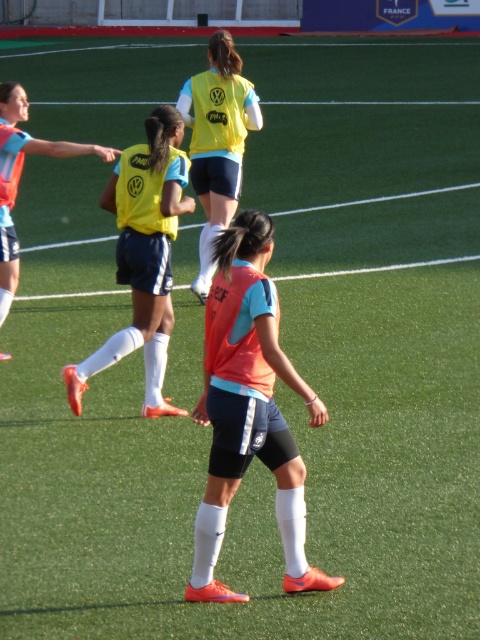
This screenshot has width=480, height=640. I want to click on yellow matte vest at center, so click(217, 141).

Between point (216, 138) and point (12, 131), which one is positioned in front?

Positioned in front is point (12, 131).

Find the location of a particular element. This screenshot has width=480, height=640. yellow matte vest at center is located at coordinates (217, 141).

Does orange matte vest at center have a greater height compared to yellow matte jersey at center?

No.

Can you confirm if orange matte vest at center is wider than yellow matte jersey at center?

No.

Does point (251, 232) lie in front of point (121, 180)?

Yes, point (251, 232) is in front of point (121, 180).

At what (x,y) coordinates should I click in order to perform the action: click on orange matte vest at center. Please return your answer as a coordinate pair (x, y). Image resolution: width=480 pixels, height=640 pixels. Looking at the image, I should click on (249, 406).

Is yellow matte jersey at center smaller than matte orange jersey at left?

Yes.

Who is positioned more to the left, yellow matte jersey at center or matte orange jersey at left?

matte orange jersey at left is more to the left.

Which is in front, point (131, 150) or point (3, 152)?

Positioned in front is point (131, 150).

Where is `yellow matte jersey at center`? The width and height of the screenshot is (480, 640). yellow matte jersey at center is located at coordinates (143, 253).